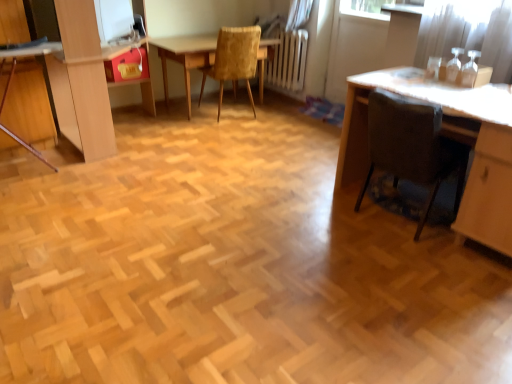
Question: From a real-world perspective, is velvet yellow chair at center, the 2th chair viewed from the right, physically above matte red drawer at upper left?

Choices:
 (A) no
 (B) yes

Answer: (A)

Question: From the image's perspective, does velvet yellow chair at center, placed as the 1th chair when sorted from top to bottom, appear lower than matte red drawer at upper left?

Choices:
 (A) no
 (B) yes

Answer: (A)

Question: Is velvet yellow chair at center, placed as the 1th chair when sorted from top to bottom, not near matte red drawer at upper left?

Choices:
 (A) yes
 (B) no

Answer: (B)

Question: Is velvet yellow chair at center, which ranks as the second chair in bottom-to-top order, to the left of matte red drawer at upper left from the viewer's perspective?

Choices:
 (A) yes
 (B) no

Answer: (B)

Question: From a real-world perspective, is velvet yellow chair at center, which ranks as the second chair in bottom-to-top order, located beneath matte red drawer at upper left?

Choices:
 (A) no
 (B) yes

Answer: (B)

Question: Is velvet yellow chair at center, which is the second chair in front-to-back order, facing towards matte red drawer at upper left?

Choices:
 (A) yes
 (B) no

Answer: (B)

Question: Can you confirm if matte red drawer at upper left is taller than wooden table at center?

Choices:
 (A) yes
 (B) no

Answer: (B)

Question: Does matte red drawer at upper left have a lesser height compared to wooden table at center?

Choices:
 (A) no
 (B) yes

Answer: (B)

Question: Is matte red drawer at upper left looking in the opposite direction of wooden table at center?

Choices:
 (A) yes
 (B) no

Answer: (B)

Question: From the image's perspective, is matte red drawer at upper left beneath wooden table at center?

Choices:
 (A) yes
 (B) no

Answer: (A)

Question: Can you confirm if matte red drawer at upper left is positioned to the left of wooden table at center?

Choices:
 (A) no
 (B) yes

Answer: (B)

Question: Can you confirm if matte red drawer at upper left is wider than wooden table at center?

Choices:
 (A) no
 (B) yes

Answer: (A)

Question: Does brown fabric chair at lower right, which is the 2th chair from back to front, appear on the right side of matte red drawer at upper left?

Choices:
 (A) no
 (B) yes

Answer: (B)